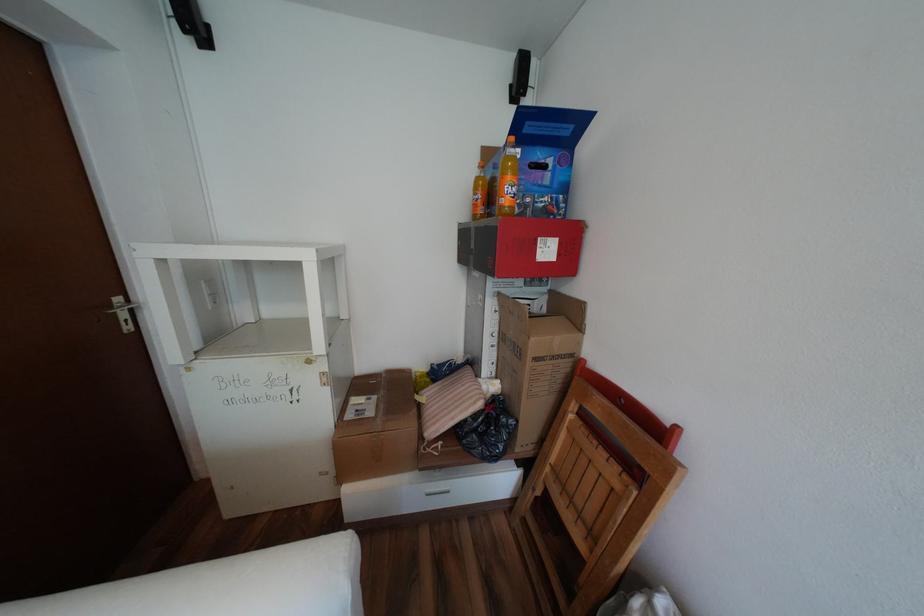
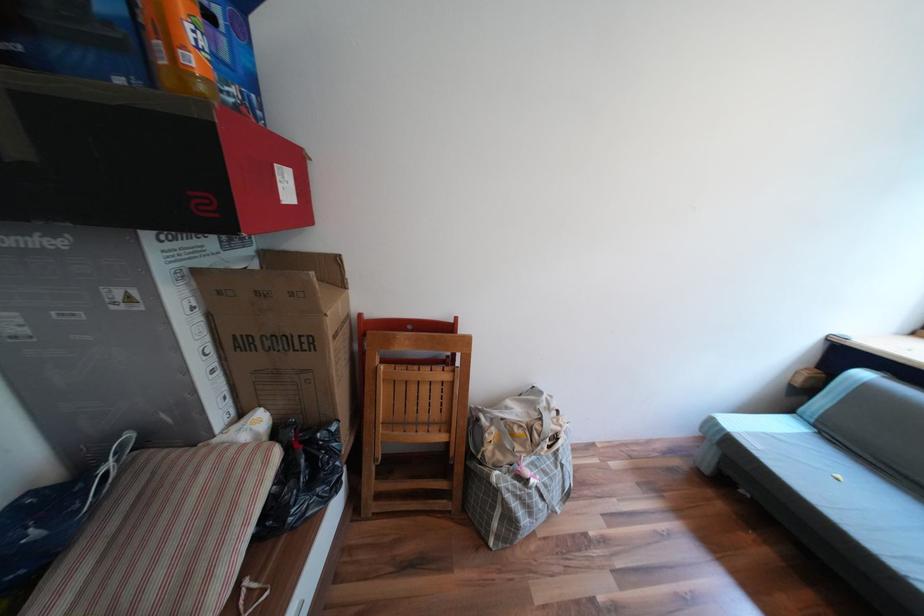
Looking at this image, the first image is from the beginning of the video and the second image is from the end. How did the camera likely rotate when shooting the video?

The camera rotated toward right-down.